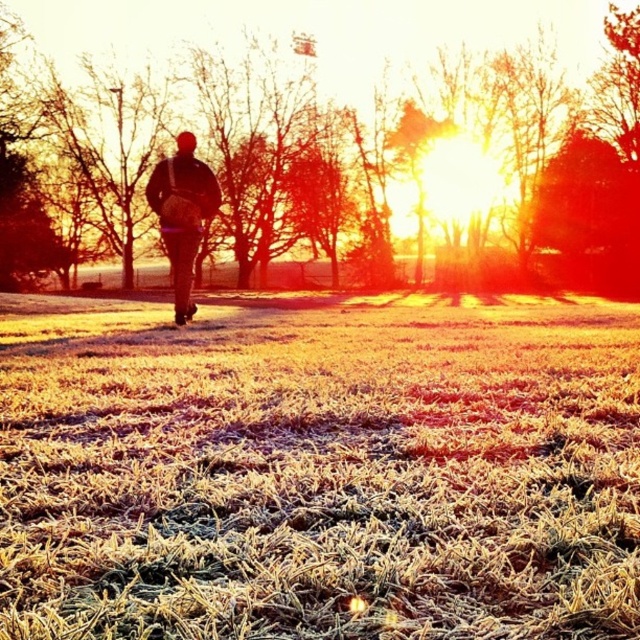
Is point (35, 346) positioned behind point (161, 188)?

No, it is not.

I want to click on frosted grass at center, so click(317, 468).